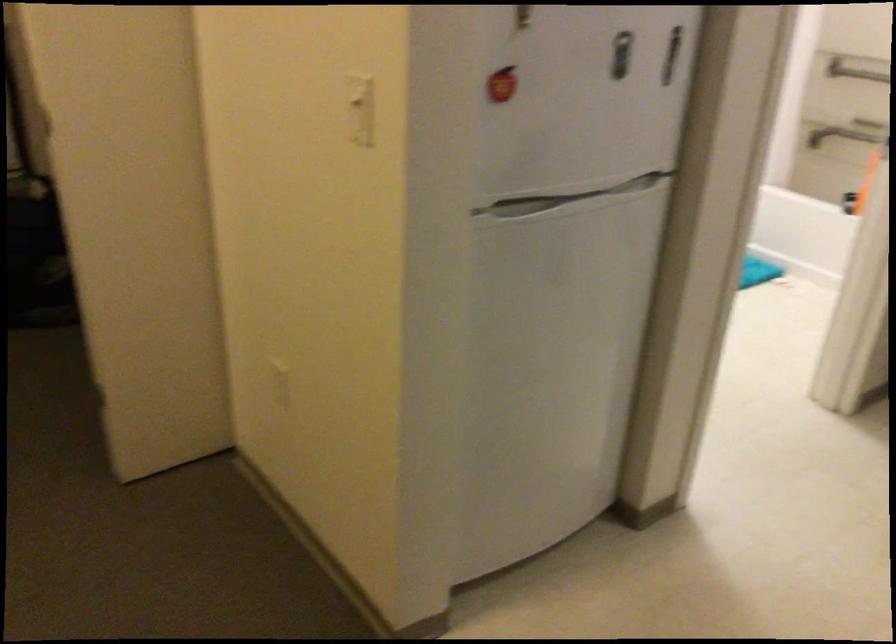
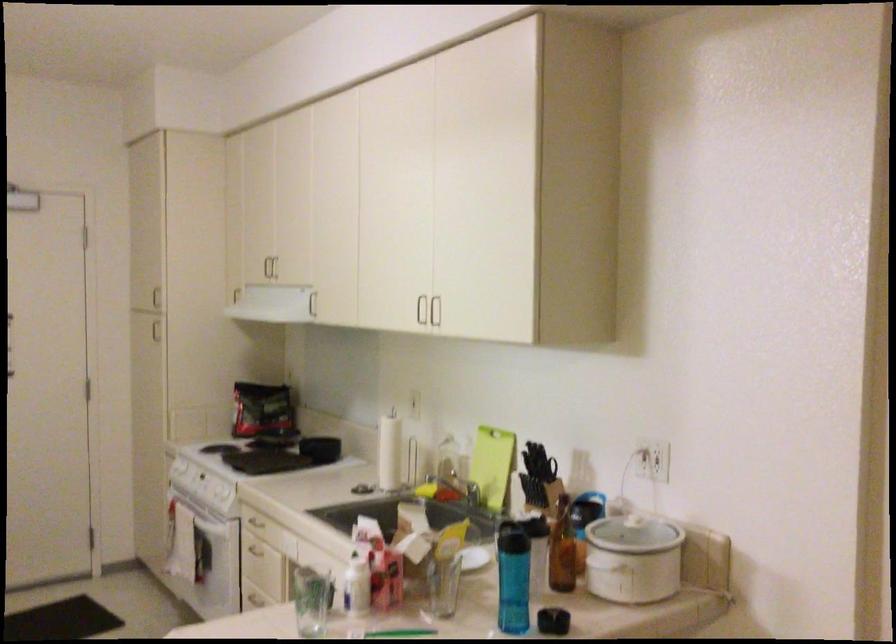
Question: The first image is from the beginning of the video and the second image is from the end. How did the camera likely rotate when shooting the video?

Choices:
 (A) Left
 (B) Right
 (C) Up
 (D) Down

Answer: (B)